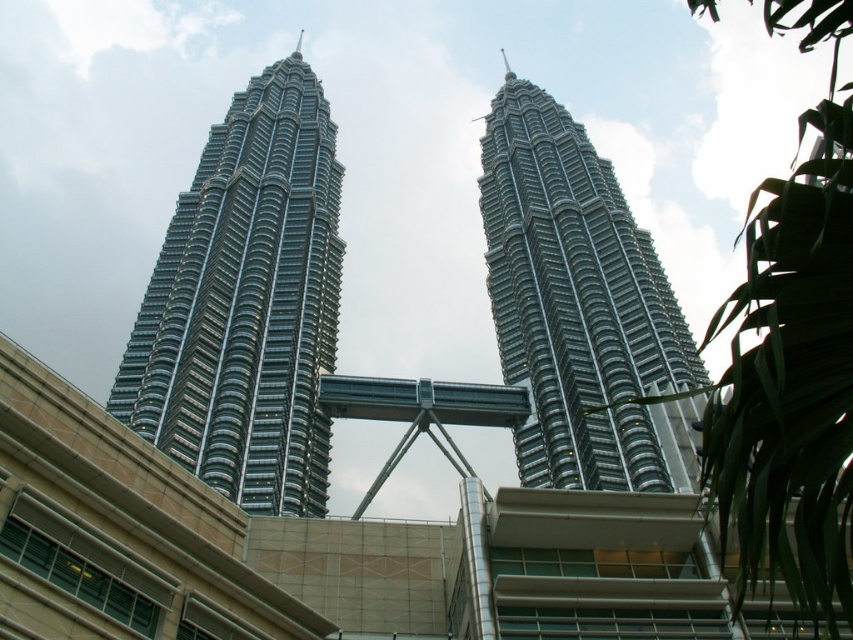
Question: Does glassy steel skyscraper at center appear over shiny glass skyscraper at center?

Choices:
 (A) no
 (B) yes

Answer: (B)

Question: In this image, where is glassy steel skyscraper at center located relative to shiny glass skyscraper at center?

Choices:
 (A) below
 (B) above

Answer: (B)

Question: Does glassy steel skyscraper at center appear under shiny glass skyscraper at center?

Choices:
 (A) no
 (B) yes

Answer: (A)

Question: Which of the following is the farthest from the observer?

Choices:
 (A) (329, 156)
 (B) (498, 260)

Answer: (A)

Question: Which object appears farthest from the camera in this image?

Choices:
 (A) glassy steel skyscraper at center
 (B) shiny glass skyscraper at center

Answer: (B)